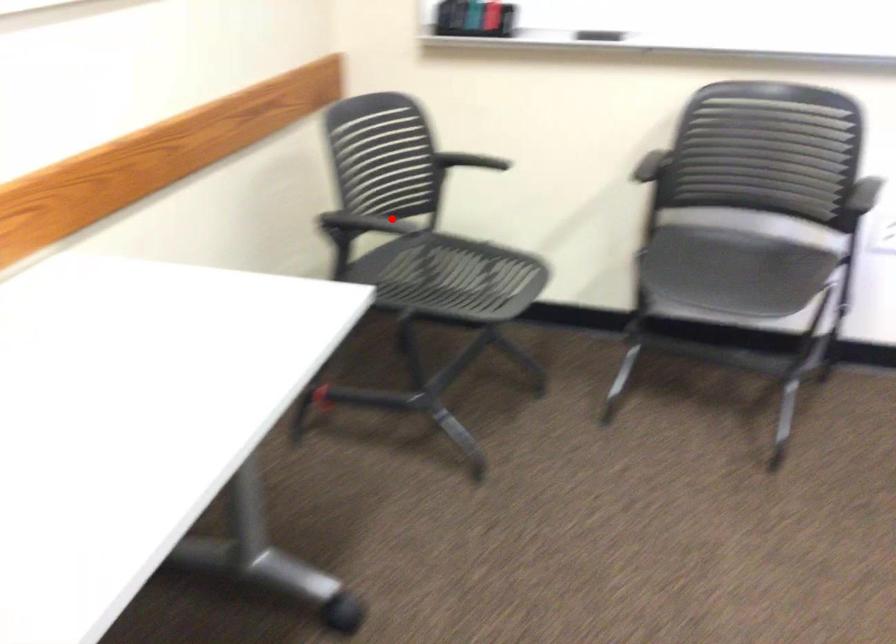
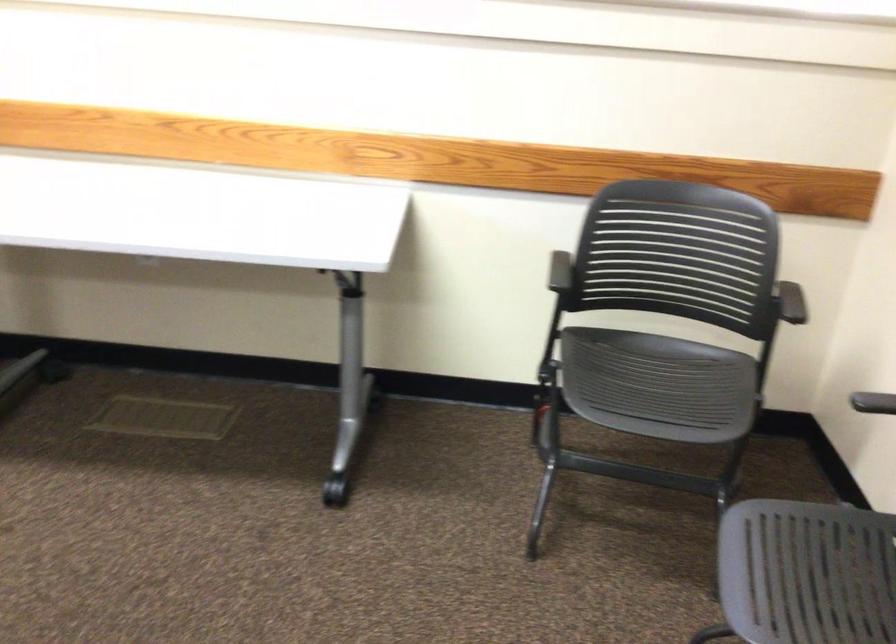
The point at the highlighted location is marked in the first image. Where is the corresponding point in the second image?

(560, 270)